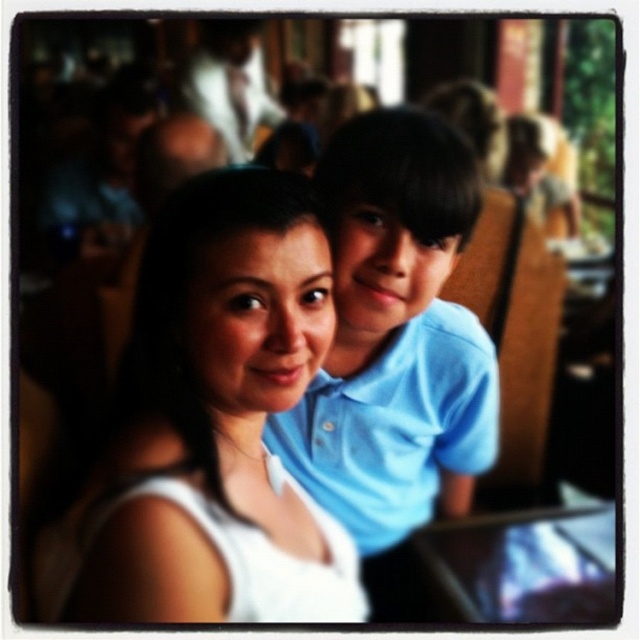
Question: Which object appears farthest from the camera in this image?

Choices:
 (A) white matte tank top at center
 (B) blue cotton shirt at center
 (C) white fabric at upper center
 (D) metallic silver laptop at center

Answer: (D)

Question: Does blue cotton shirt at center appear over white fabric at upper center?

Choices:
 (A) yes
 (B) no

Answer: (B)

Question: Is metallic silver laptop at center behind white fabric at upper center?

Choices:
 (A) yes
 (B) no

Answer: (A)

Question: Which point is farther from the camera taking this photo?

Choices:
 (A) (436, 432)
 (B) (284, 116)
 (C) (280, 314)
 (D) (442, 556)

Answer: (A)

Question: Which point is farther from the camera taking this photo?

Choices:
 (A) (499, 577)
 (B) (472, 442)
 (C) (241, 161)
 (D) (246, 477)

Answer: (B)

Question: Is blue cotton shirt at center to the right of metallic silver laptop at center from the viewer's perspective?

Choices:
 (A) yes
 (B) no

Answer: (B)